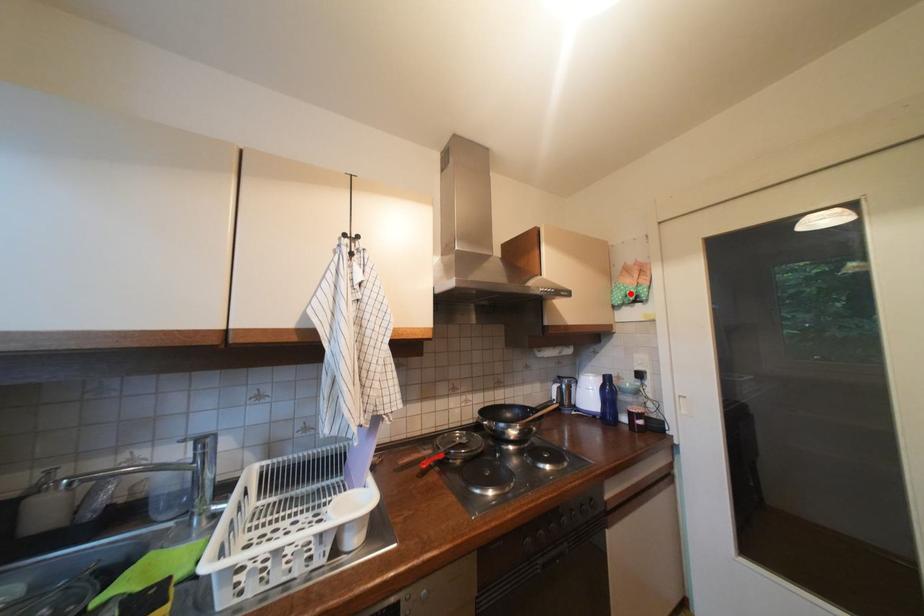
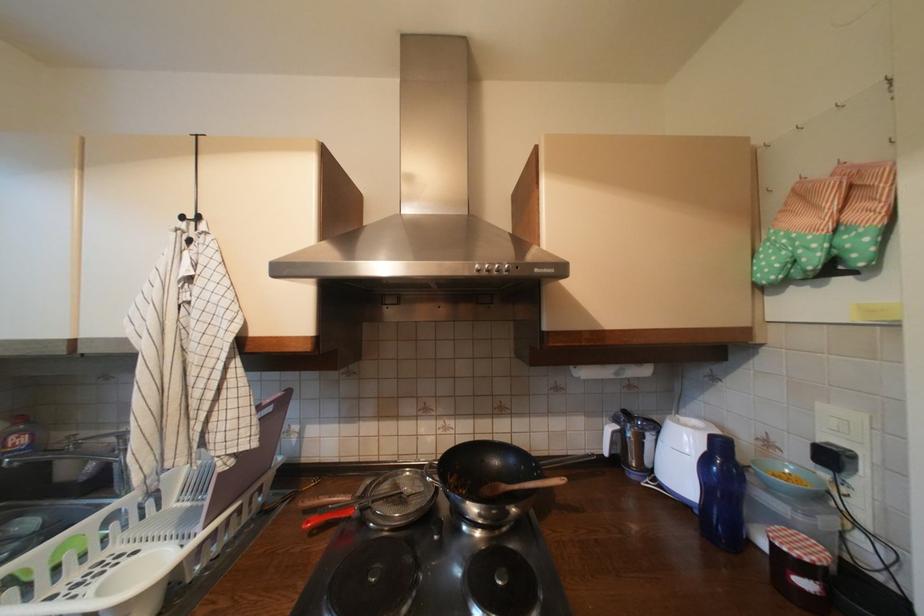
The point at the highlighted location is marked in the first image. Where is the corresponding point in the second image?

(793, 254)